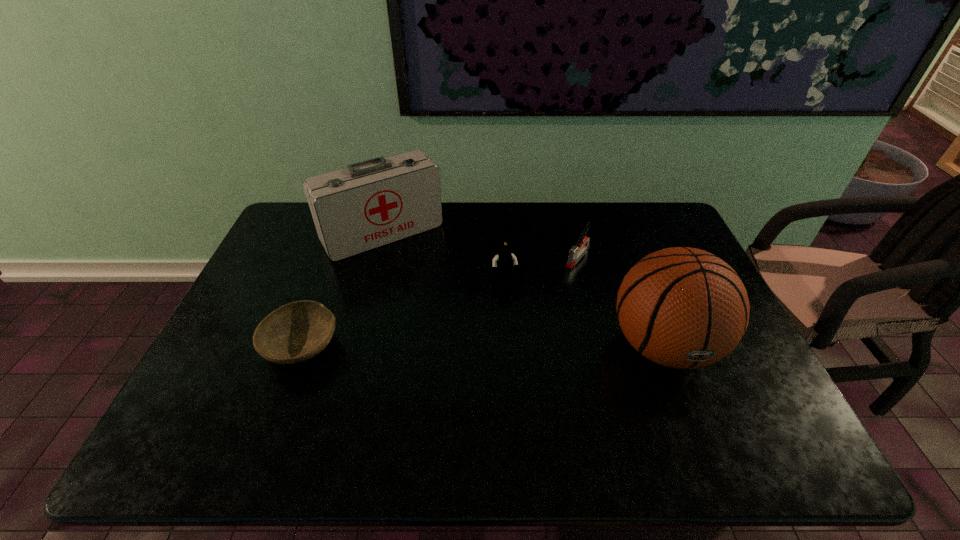
Identify the location of vacant space located 0.230m on the handle side of the second shortest object. (535, 310).

Image resolution: width=960 pixels, height=540 pixels. I want to click on vacant space located on the front-facing side of the second tallest object, so click(x=420, y=275).

This screenshot has width=960, height=540. Identify the location of vacant space located on the front-facing side of the second tallest object. (424, 281).

At what (x,y) coordinates should I click in order to perform the action: click on vacant space located on the front-facing side of the second tallest object. Please return your answer as a coordinate pair (x, y). Looking at the image, I should click on (418, 272).

The image size is (960, 540). Find the location of `free spot located on the front-facing side of the third tallest object`. free spot located on the front-facing side of the third tallest object is located at coordinates (523, 343).

This screenshot has height=540, width=960. I want to click on vacant space located on the front-facing side of the third tallest object, so click(x=524, y=347).

The image size is (960, 540). I want to click on vacant space situated 0.360m on the front-facing side of the third tallest object, so click(x=536, y=389).

Where is `object located at the far edge`? object located at the far edge is located at coordinates (372, 203).

Where is `object located at the near edge`? This screenshot has height=540, width=960. object located at the near edge is located at coordinates (681, 307).

At what (x,y) coordinates should I click in order to perform the action: click on bowl present at the left edge. Please return your answer as a coordinate pair (x, y). This screenshot has width=960, height=540. Looking at the image, I should click on (295, 332).